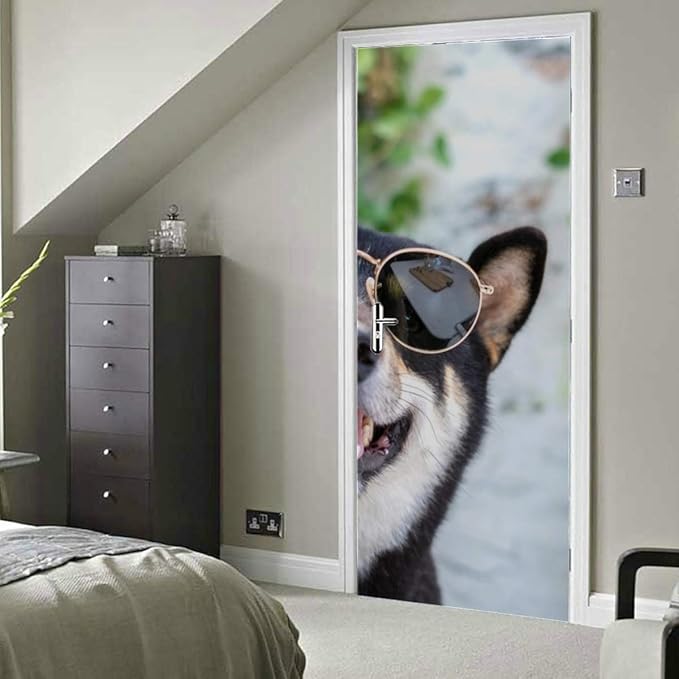
At what (x,y) coordinates should I click in order to perform the action: click on chair arm. Please return your answer as a coordinate pair (x, y). The height and width of the screenshot is (679, 679). Looking at the image, I should click on (639, 561), (672, 659).